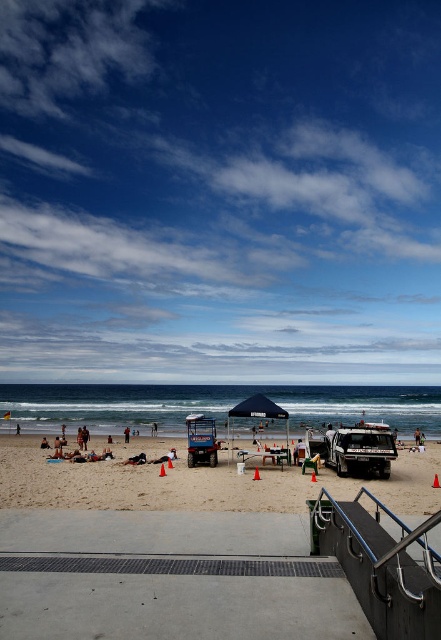
Question: Does metallic blue jeep at center have a larger size compared to tan skin person at lower center?

Choices:
 (A) no
 (B) yes

Answer: (B)

Question: Which of these objects is positioned farthest from the blue sky at upper center?

Choices:
 (A) tan skin person at lower center
 (B) polished metal handrail at lower right
 (C) metallic blue jeep at center
 (D) brown fabric umbrella at center

Answer: (B)

Question: Does tan fabric towel at lower center have a smaller size compared to tan skin person at center?

Choices:
 (A) no
 (B) yes

Answer: (B)

Question: Considering the real-world distances, which object is farthest from the metallic silver jeep at lower center?

Choices:
 (A) tan fabric towel at lower center
 (B) tan skin person at center
 (C) polished metal handrail at lower right
 (D) brown fabric umbrella at center

Answer: (D)

Question: Among these objects, which one is nearest to the camera?

Choices:
 (A) metallic blue jeep at center
 (B) white sand at center

Answer: (B)

Question: Where is metallic silver jeep at lower center located in relation to tan skin person at lower center in the image?

Choices:
 (A) right
 (B) left

Answer: (B)